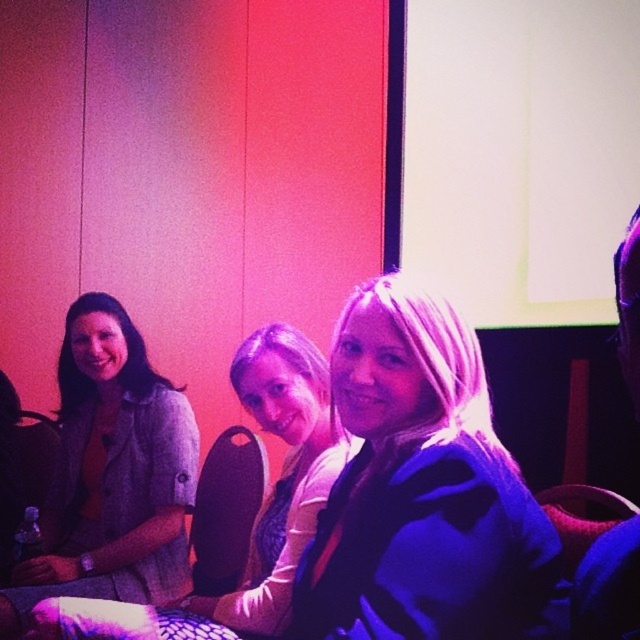
You are a photographer at this event and want to capture a photo of the two people wearing the satin blue dress at center and the matte gray blazer at left. The camera has a focus setting that requires the thicker object to be closer to the lens. Which one should you position closer to the camera?

The matte gray blazer at left is thicker than the satin blue dress at center, so you should position the matte gray blazer at left closer to the camera to ensure proper focus.

You are a photographer at the event and want to ensure both the satin blue dress at center and the matte gray blazer at center are clearly visible in your photo. Given their sizes, which one might you need to position closer to the camera to maintain clarity?

The satin blue dress at center is smaller than the matte gray blazer at center. To ensure clarity, you should position the satin blue dress at center closer to the camera since its smaller size may require closer focus to capture details effectively.